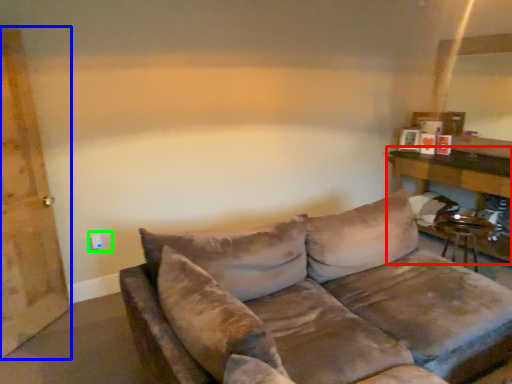
Question: Based on their relative distances, which object is nearer to table (highlighted by a red box)? Choose from barn door (highlighted by a blue box) and electric outlet (highlighted by a green box).

Choices:
 (A) barn door
 (B) electric outlet

Answer: (B)